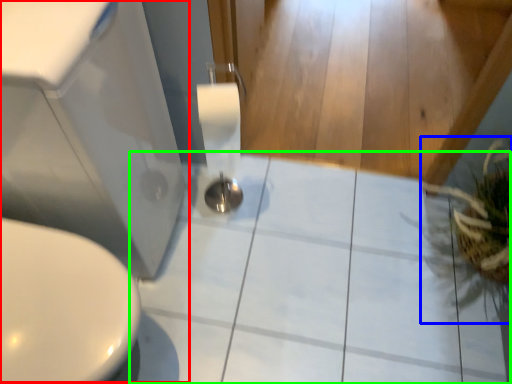
Question: Which object is positioned farthest from sink (highlighted by a red box)? Select from plant (highlighted by a blue box) and ceramic tile (highlighted by a green box).

Choices:
 (A) plant
 (B) ceramic tile

Answer: (A)